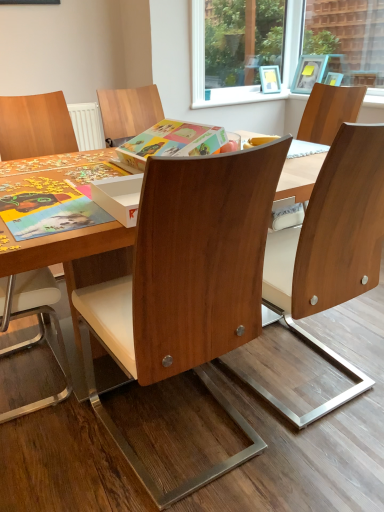
Question: In the image, is wooden picture frame at upper right positioned in front of or behind wooden chair at center, the first chair viewed from the right?

Choices:
 (A) front
 (B) behind

Answer: (B)

Question: Considering the positions of wooden picture frame at upper right and wooden chair at center, acting as the 3th chair starting from the left, in the image, is wooden picture frame at upper right wider or thinner than wooden chair at center, acting as the 3th chair starting from the left,?

Choices:
 (A) wide
 (B) thin

Answer: (B)

Question: Estimate the real-world distances between objects in this image. Which object is closer to the wooden chair at center, the first chair viewed from the right?

Choices:
 (A) matte cardboard book at center
 (B) wooden chair at center, the 2th chair in the left-to-right sequence
 (C) wooden picture frame at upper right
 (D) wooden chair at left, which is the 3th chair in right-to-left order

Answer: (B)

Question: Which object is the closest to the wooden picture frame at upper right?

Choices:
 (A) wooden chair at center, arranged as the second chair when viewed from the right
 (B) matte cardboard book at center
 (C) wooden chair at center, the first chair viewed from the right
 (D) wooden chair at left, the 1th chair in the left-to-right sequence

Answer: (B)